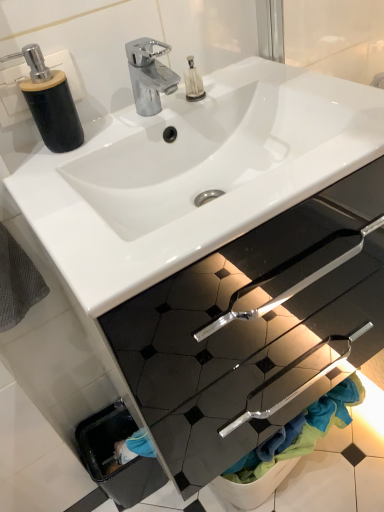
Question: Can you confirm if matte black soap dispenser at upper left is thinner than white glossy sink at center?

Choices:
 (A) no
 (B) yes

Answer: (B)

Question: Is matte black soap dispenser at upper left far from white glossy sink at center?

Choices:
 (A) no
 (B) yes

Answer: (A)

Question: From a real-world perspective, is matte black soap dispenser at upper left on top of white glossy sink at center?

Choices:
 (A) yes
 (B) no

Answer: (A)

Question: From the image's perspective, is matte black soap dispenser at upper left above white glossy sink at center?

Choices:
 (A) yes
 (B) no

Answer: (A)

Question: Is matte black soap dispenser at upper left aimed at white glossy sink at center?

Choices:
 (A) yes
 (B) no

Answer: (B)

Question: From the image's perspective, is gray textured towel at lower left positioned above or below white glossy sink at center?

Choices:
 (A) below
 (B) above

Answer: (A)

Question: In terms of height, does gray textured towel at lower left look taller or shorter compared to white glossy sink at center?

Choices:
 (A) tall
 (B) short

Answer: (A)

Question: Is point (16, 287) positioned closer to the camera than point (231, 178)?

Choices:
 (A) closer
 (B) farther

Answer: (A)

Question: Is gray textured towel at lower left inside or outside of white glossy sink at center?

Choices:
 (A) inside
 (B) outside

Answer: (B)

Question: Considering the relative positions of white glossy sink at center and gray textured towel at lower left in the image provided, is white glossy sink at center to the left or to the right of gray textured towel at lower left?

Choices:
 (A) left
 (B) right

Answer: (B)

Question: Considering the positions of point (316, 117) and point (31, 288), is point (316, 117) closer or farther from the camera than point (31, 288)?

Choices:
 (A) farther
 (B) closer

Answer: (B)

Question: Is white glossy sink at center situated inside gray textured towel at lower left or outside?

Choices:
 (A) inside
 (B) outside

Answer: (B)

Question: Is white glossy sink at center wider or thinner than gray textured towel at lower left?

Choices:
 (A) thin
 (B) wide

Answer: (B)

Question: Relative to white glossy sink at center, is matte black soap dispenser at upper left in front or behind?

Choices:
 (A) behind
 (B) front

Answer: (A)

Question: Is matte black soap dispenser at upper left inside or outside of white glossy sink at center?

Choices:
 (A) inside
 (B) outside

Answer: (B)